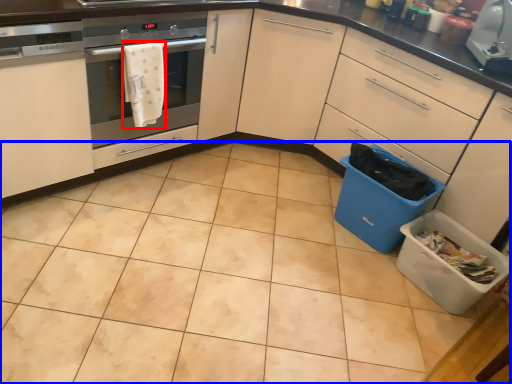
Question: Which point is closer to the camera, material (highlighted by a red box) or ceramic tile (highlighted by a blue box)?

Choices:
 (A) material
 (B) ceramic tile

Answer: (B)